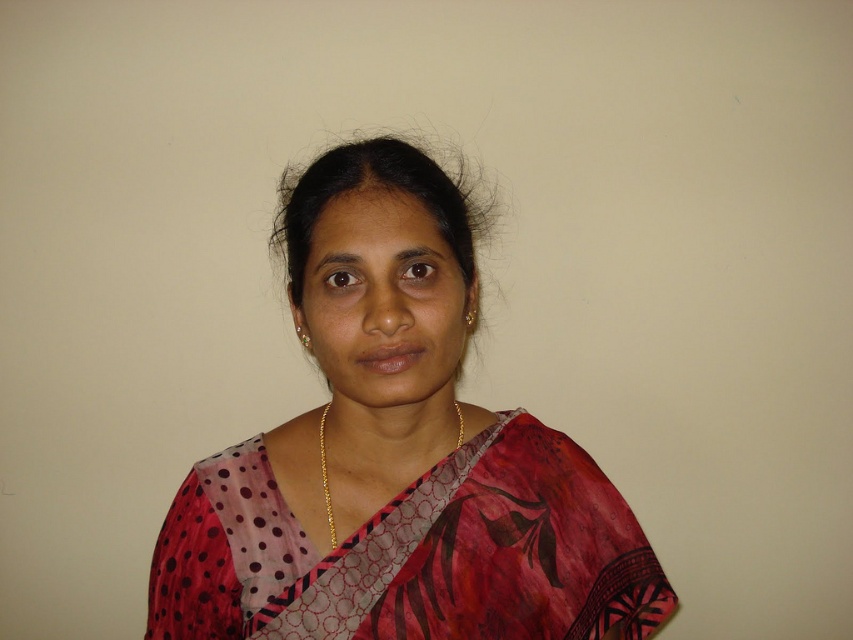
From the picture: Is polka dot chiffon sari at center to the right of gold chain necklace at center from the viewer's perspective?

Correct, you'll find polka dot chiffon sari at center to the right of gold chain necklace at center.

Does point (341, 573) lie in front of point (462, 417)?

That is True.

Where is `polka dot chiffon sari at center`? This screenshot has width=853, height=640. polka dot chiffon sari at center is located at coordinates (413, 552).

Does polka dot fabric saree at center lie behind polka dot chiffon sari at center?

No.

Who is taller, polka dot fabric saree at center or polka dot chiffon sari at center?

polka dot fabric saree at center

Which is in front, point (335, 454) or point (212, 541)?

Point (212, 541) is more forward.

Where is `polka dot fabric saree at center`? Image resolution: width=853 pixels, height=640 pixels. polka dot fabric saree at center is located at coordinates (396, 456).

Which is in front, point (448, 573) or point (461, 419)?

Point (448, 573) is more forward.

Can you confirm if polka dot fabric saree at center is smaller than gold chain necklace at center?

No, polka dot fabric saree at center is not smaller than gold chain necklace at center.

Which is in front, point (491, 454) or point (454, 403)?

Positioned in front is point (491, 454).

You are a GUI agent. You are given a task and a screenshot of the screen. Output one action in this format:
    pyautogui.click(x=<x>, y=<y>)
    Task: Click on the polka dot fabric saree at center
    
    Given the screenshot: What is the action you would take?
    pyautogui.click(x=396, y=456)